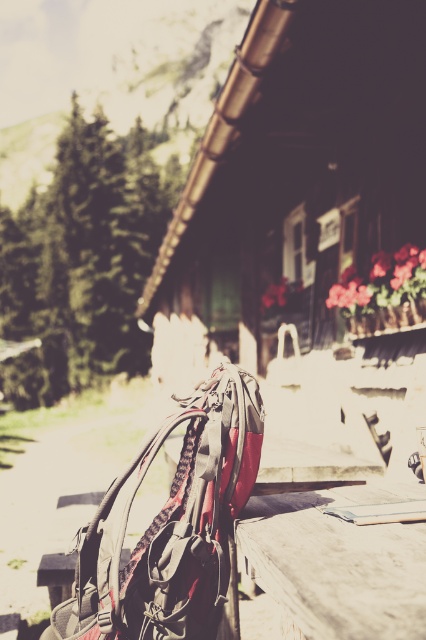
Question: Which object appears farthest from the camera in this image?

Choices:
 (A) wooden cabin at center
 (B) matte black backpack at center

Answer: (A)

Question: Can you confirm if green textured pine at left is positioned to the right of matte black backpack at center?

Choices:
 (A) no
 (B) yes

Answer: (A)

Question: Which of these objects is positioned farthest from the wooden table at center?

Choices:
 (A) green textured pine at left
 (B) wooden cabin at center
 (C) matte black backpack at center

Answer: (A)

Question: Is wooden cabin at center wider than matte black backpack at center?

Choices:
 (A) yes
 (B) no

Answer: (A)

Question: Is wooden cabin at center below matte black backpack at center?

Choices:
 (A) yes
 (B) no

Answer: (B)

Question: Which object is farther from the camera taking this photo?

Choices:
 (A) green textured pine at left
 (B) matte black backpack at center
 (C) wooden table at center
 (D) wooden cabin at center

Answer: (A)